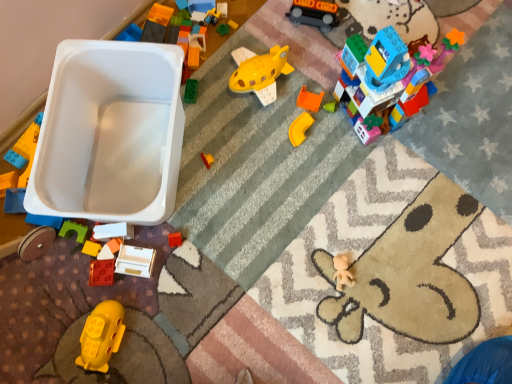
Identify the location of free space to the left of yellow matte toy submarine at lower left, which is counted as the eighth toy, starting from the top. The image size is (512, 384). 44,328.